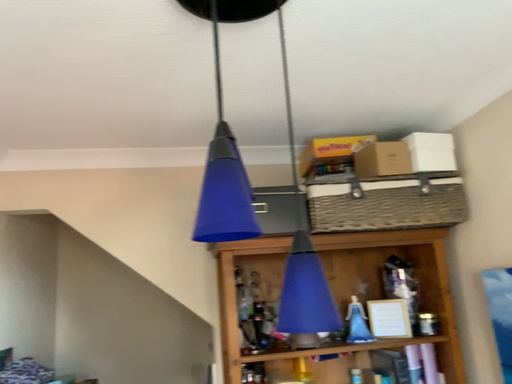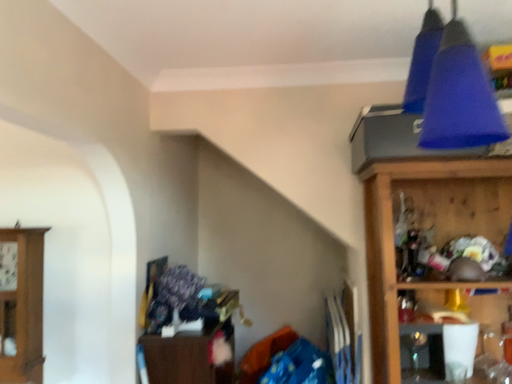
Question: How did the camera likely rotate when shooting the video?

Choices:
 (A) rotated right
 (B) rotated left

Answer: (B)